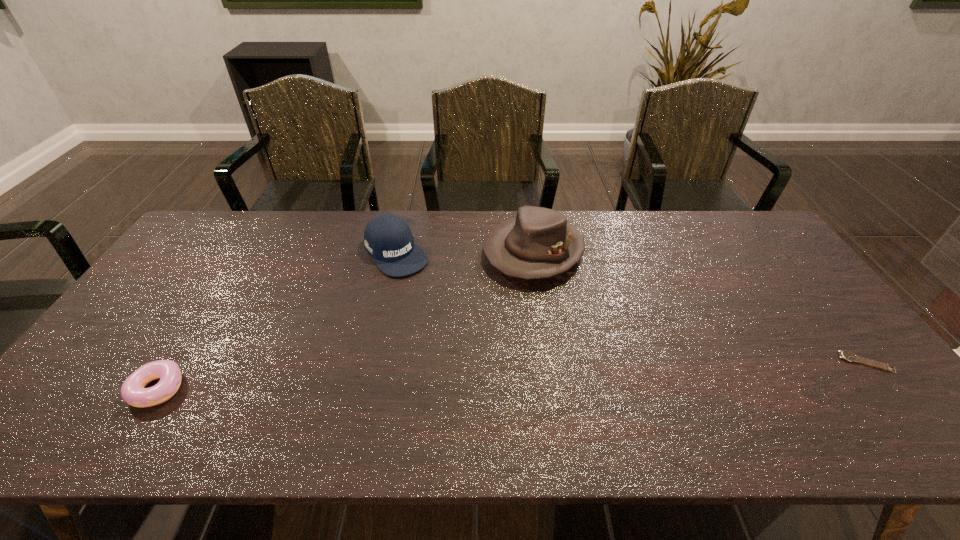
Find the location of a particular element. This screenshot has width=960, height=540. vacant space on the desktop that is between the doughnut and the rightmost object and is positioned on the decorative side of the tallest object is located at coordinates (420, 379).

Locate an element on the screen. Image resolution: width=960 pixels, height=540 pixels. free space on the desktop that is between the doughnut and the shortest object and is positioned on the front-facing side of the baseball cap is located at coordinates (501, 376).